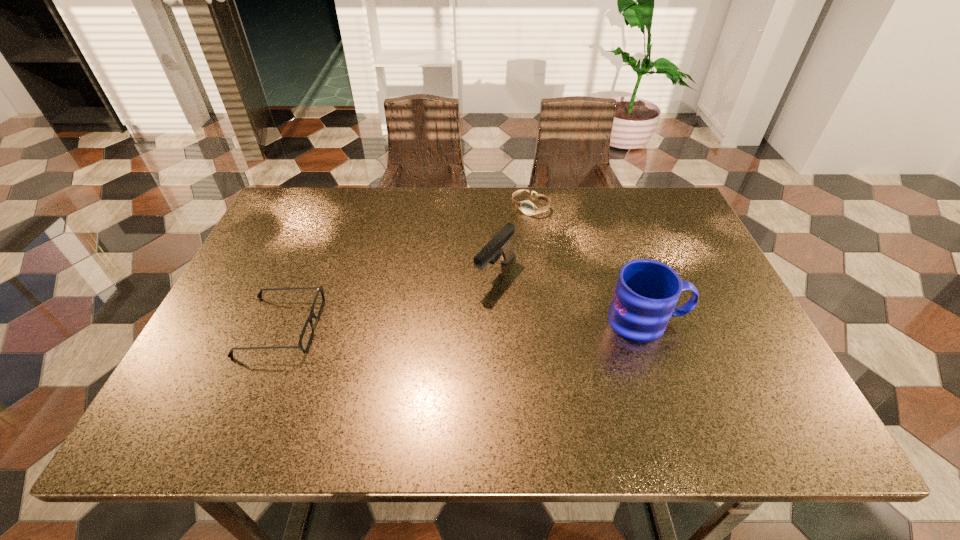
This screenshot has height=540, width=960. In the image, there is a desktop. In order to click on free space at the far edge in this screenshot , I will do `click(469, 220)`.

Image resolution: width=960 pixels, height=540 pixels. I want to click on free space at the near edge, so click(588, 374).

Locate an element on the screen. free space at the left edge is located at coordinates (307, 260).

This screenshot has width=960, height=540. I want to click on vacant space at the right edge of the desktop, so click(x=731, y=315).

Locate an element on the screen. vacant space at the far left corner of the desktop is located at coordinates (300, 224).

Image resolution: width=960 pixels, height=540 pixels. In order to click on free region at the far right corner of the desktop in this screenshot , I will do `click(632, 187)`.

In the image, there is a desktop. Identify the location of vacant space at the near right corner. Image resolution: width=960 pixels, height=540 pixels. (751, 392).

The height and width of the screenshot is (540, 960). Identify the location of free space between the third object from right to left and the watch. coord(513,240).

Identify the location of free point between the farthest object and the mug. (588, 264).

Locate an element on the screen. The height and width of the screenshot is (540, 960). empty space that is in between the leftmost object and the second tallest object is located at coordinates point(388,300).